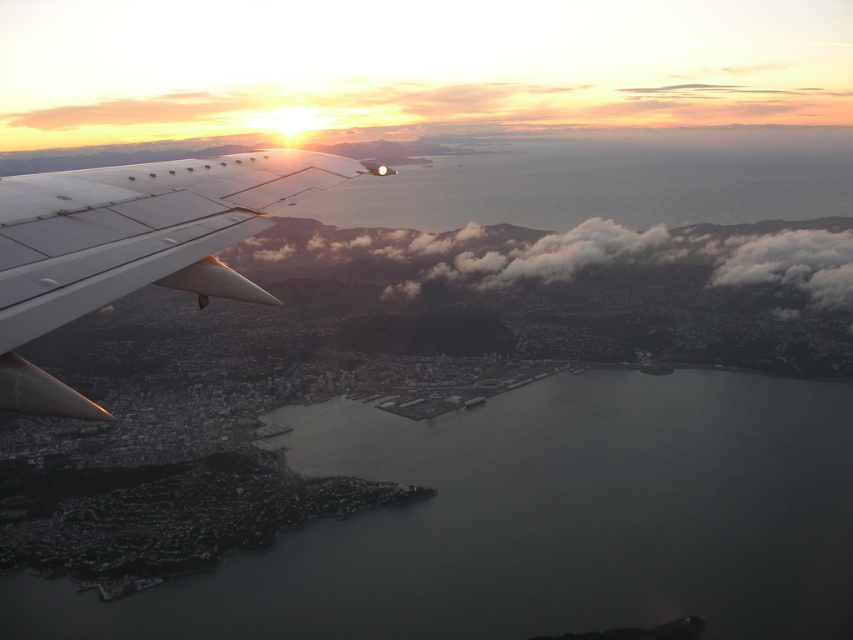
Question: Which point is farther to the camera?

Choices:
 (A) [x=357, y=163]
 (B) [x=581, y=502]

Answer: (B)

Question: Does dark gray water at lower center have a smaller size compared to white fluffy clouds at center?

Choices:
 (A) no
 (B) yes

Answer: (A)

Question: Does metallic gray wing at left have a greater width compared to white fluffy clouds at center?

Choices:
 (A) no
 (B) yes

Answer: (A)

Question: Estimate the real-world distances between objects in this image. Which object is closer to the metallic gray wing at left?

Choices:
 (A) white fluffy clouds at center
 (B) dark gray water at lower center

Answer: (A)

Question: Where is dark gray water at lower center located in relation to white fluffy clouds at center in the image?

Choices:
 (A) below
 (B) above

Answer: (A)

Question: Based on their relative distances, which object is farther from the white fluffy clouds at center?

Choices:
 (A) dark gray water at lower center
 (B) metallic gray wing at left

Answer: (B)